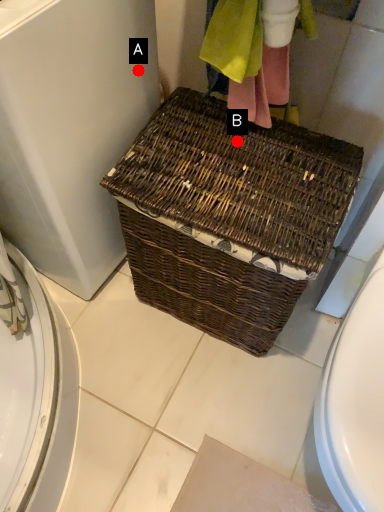
Question: Two points are circled on the image, labeled by A and B beside each circle. Which of the following is the closest to the observer?

Choices:
 (A) A is closer
 (B) B is closer

Answer: (B)